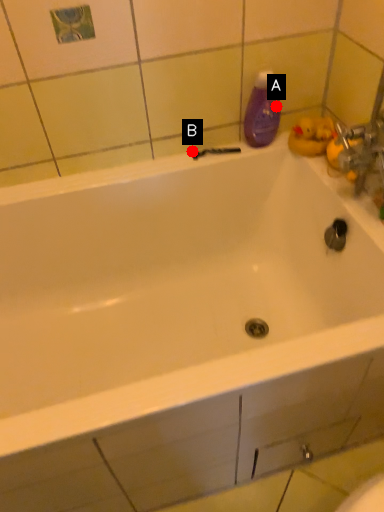
Question: Two points are circled on the image, labeled by A and B beside each circle. Which point appears farthest from the camera in this image?

Choices:
 (A) A is further
 (B) B is further

Answer: (B)